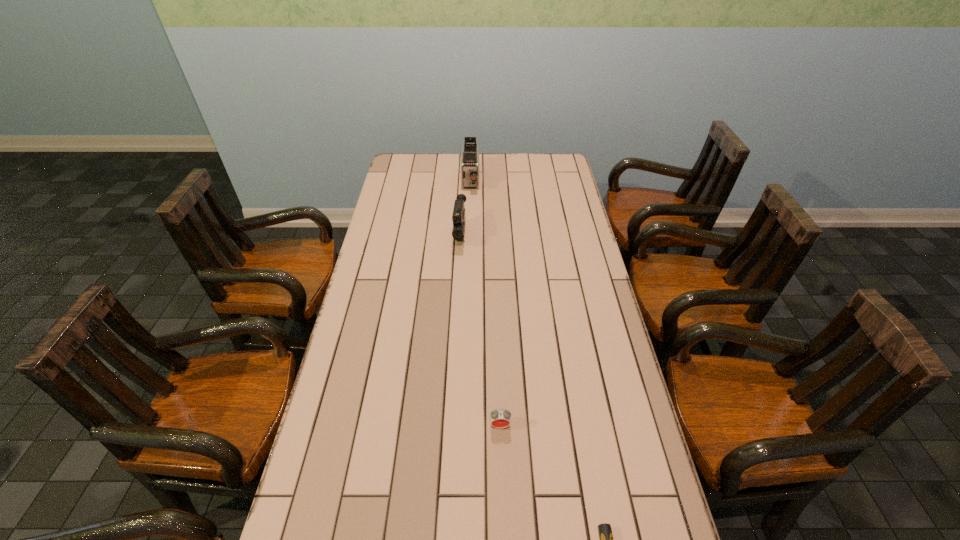
Locate an element on the screen. object that is the third closest one to the third tallest object is located at coordinates pos(470,150).